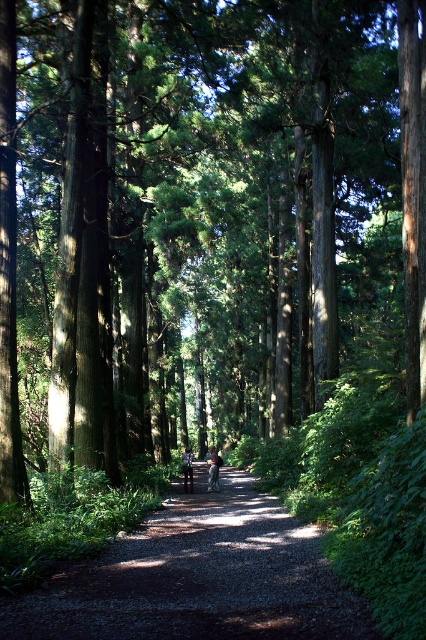
Describe the element at coordinates (198, 577) in the screenshot. I see `dirt/gravel path at center` at that location.

Who is lower down, dirt/gravel path at center or brown leather jacket at center?

Positioned lower is brown leather jacket at center.

Does point (253, 545) come in front of point (219, 460)?

Yes, it is in front of point (219, 460).

What are the coordinates of `dirt/gravel path at center` in the screenshot? It's located at pyautogui.click(x=198, y=577).

Is point (138, 579) less distant than point (189, 490)?

Yes, it is.

Can you confirm if dirt/gravel path at center is positioned to the right of light brown leather jacket at center?

Correct, you'll find dirt/gravel path at center to the right of light brown leather jacket at center.

Is point (195, 609) closer to viewer compared to point (190, 488)?

Yes.

This screenshot has height=640, width=426. What are the coordinates of `dirt/gravel path at center` in the screenshot? It's located at (198, 577).

Can you confirm if brown leather jacket at center is positioned above light brown leather jacket at center?

Yes.

This screenshot has width=426, height=640. What are the coordinates of `brown leather jacket at center` in the screenshot? It's located at (213, 468).

Describe the element at coordinates (213, 468) in the screenshot. This screenshot has height=640, width=426. I see `brown leather jacket at center` at that location.

Where is `brown leather jacket at center`? The height and width of the screenshot is (640, 426). brown leather jacket at center is located at coordinates (213, 468).